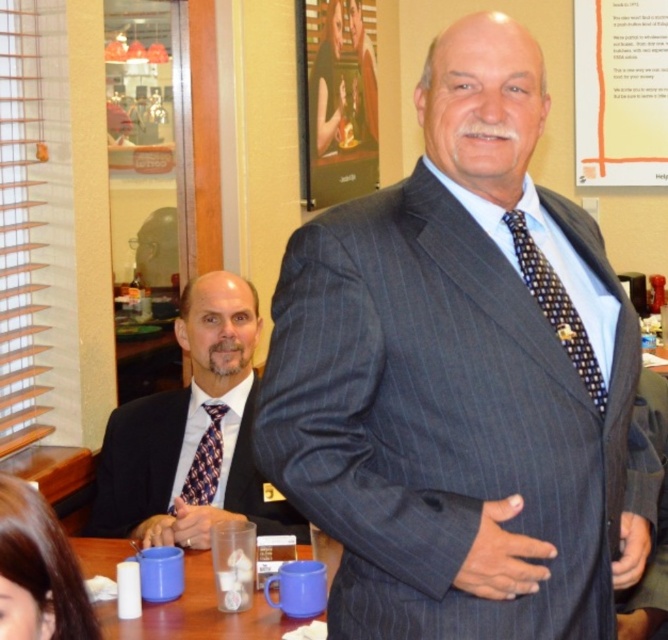
Which is behind, point (242, 637) or point (198, 492)?

Positioned behind is point (198, 492).

Does matte plastic cups at lower center have a lesser width compared to plaid silk tie at center?

Incorrect, matte plastic cups at lower center's width is not less than plaid silk tie at center's.

Is point (188, 627) more distant than point (182, 481)?

No, it is not.

At what (x,y) coordinates should I click in order to perform the action: click on matte plastic cups at lower center. Please return your answer as a coordinate pair (x, y). Looking at the image, I should click on (196, 612).

Consider the image. Can you confirm if pinstriped suit at center is positioned above black silk suit at left?

Indeed, pinstriped suit at center is positioned over black silk suit at left.

Does pinstriped suit at center appear under black silk suit at left?

Incorrect, pinstriped suit at center is not positioned below black silk suit at left.

Locate an element on the screen. This screenshot has width=668, height=640. pinstriped suit at center is located at coordinates (462, 378).

Which is above, pinstriped suit at center or plaid silk tie at center?

Positioned higher is pinstriped suit at center.

Is pinstriped suit at center closer to the viewer compared to plaid silk tie at center?

Yes, it is in front of plaid silk tie at center.

Between point (516, 467) and point (170, 508), which one is positioned behind?

Positioned behind is point (170, 508).

Identify the location of pinstriped suit at center. This screenshot has width=668, height=640. (462, 378).